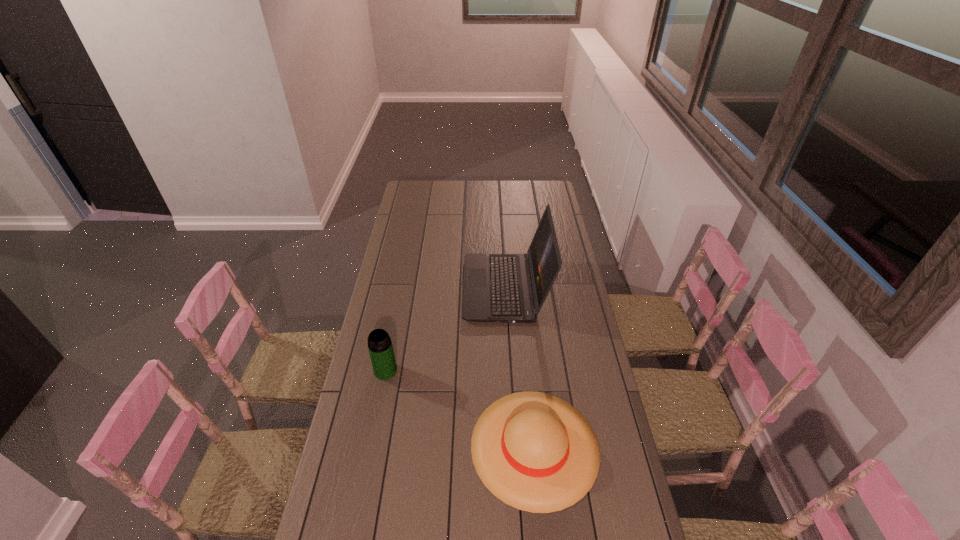
Find the location of a particular element. The image size is (960, 540). vacant area that lies between the thermos bottle and the shortest object is located at coordinates (460, 408).

The image size is (960, 540). In order to click on object that is the closest to the tallest object in this screenshot , I will do `click(380, 347)`.

This screenshot has width=960, height=540. I want to click on object that is the closest to the second nearest object, so coord(534,451).

Locate an element on the screen. This screenshot has width=960, height=540. free region that satisfies the following two spatial constraints: 1. on the screen of the laptop_computer; 2. from the spout of the second tallest object is located at coordinates (511, 370).

Find the location of a particular element. This screenshot has width=960, height=540. free location that satisfies the following two spatial constraints: 1. on the screen of the nearest object; 2. on the right side of the farthest object is located at coordinates (516, 446).

Identify the location of vacant area in the image that satisfies the following two spatial constraints: 1. from the spout of the leftmost object; 2. on the left side of the nearest object. This screenshot has width=960, height=540. (371, 446).

This screenshot has width=960, height=540. Identify the location of free point that satisfies the following two spatial constraints: 1. from the spout of the sombrero; 2. on the left side of the leftmost object. (371, 446).

You are a GUI agent. You are given a task and a screenshot of the screen. Output one action in this format:
    pyautogui.click(x=<x>, y=<y>)
    Task: Click on the vacant area that satisfies the following two spatial constraints: 1. on the screen of the tallest object; 2. from the spout of the leftmost object
    This screenshot has height=540, width=960.
    Given the screenshot: What is the action you would take?
    pyautogui.click(x=511, y=370)

Find the location of a particular element. This screenshot has width=960, height=540. free space that satisfies the following two spatial constraints: 1. on the screen of the nearest object; 2. on the left side of the tallest object is located at coordinates (516, 446).